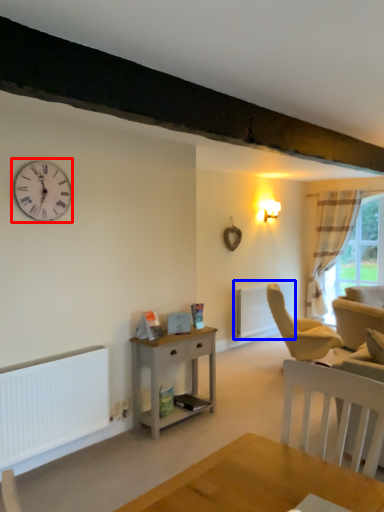
Question: Among these objects, which one is farthest to the camera, wall clock (highlighted by a red box) or radiator (highlighted by a blue box)?

Choices:
 (A) wall clock
 (B) radiator

Answer: (B)